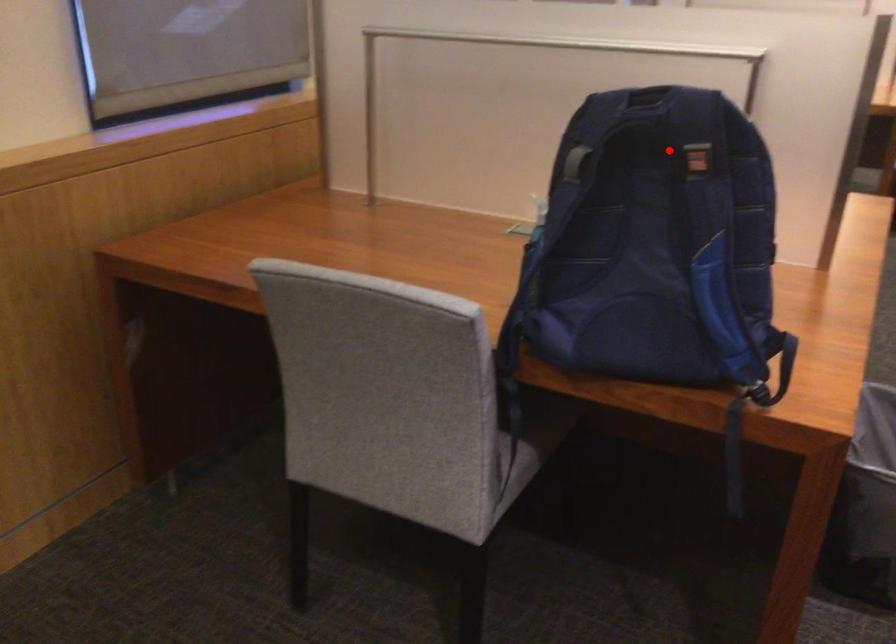
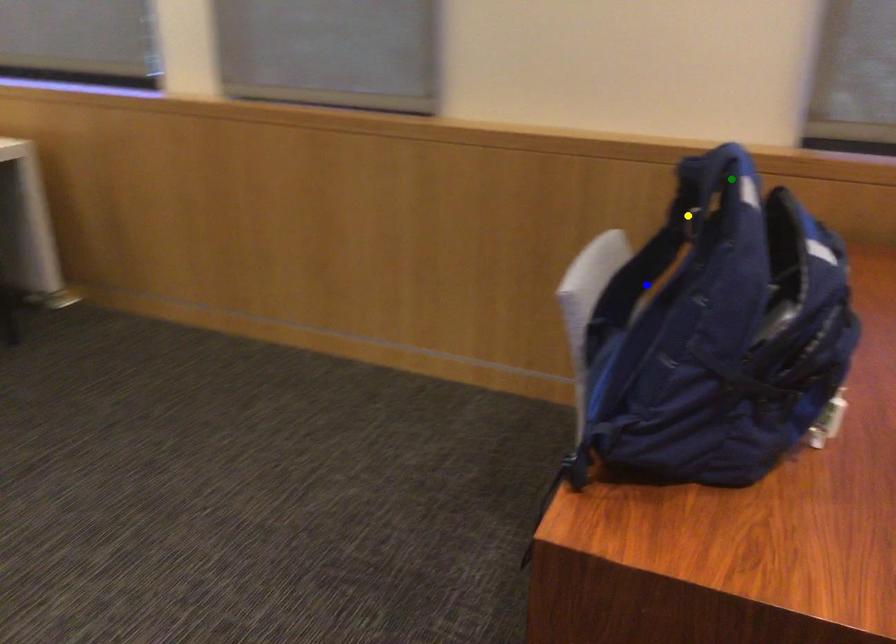
Question: I am providing you with two images of the same scene from different viewpoints. A red point is marked on the first image. You are given multiple points on the second image. Which point in image 2 is actually the same real-world point as the red point in image 1?

Choices:
 (A) yellow point
 (B) green point
 (C) blue point

Answer: (A)